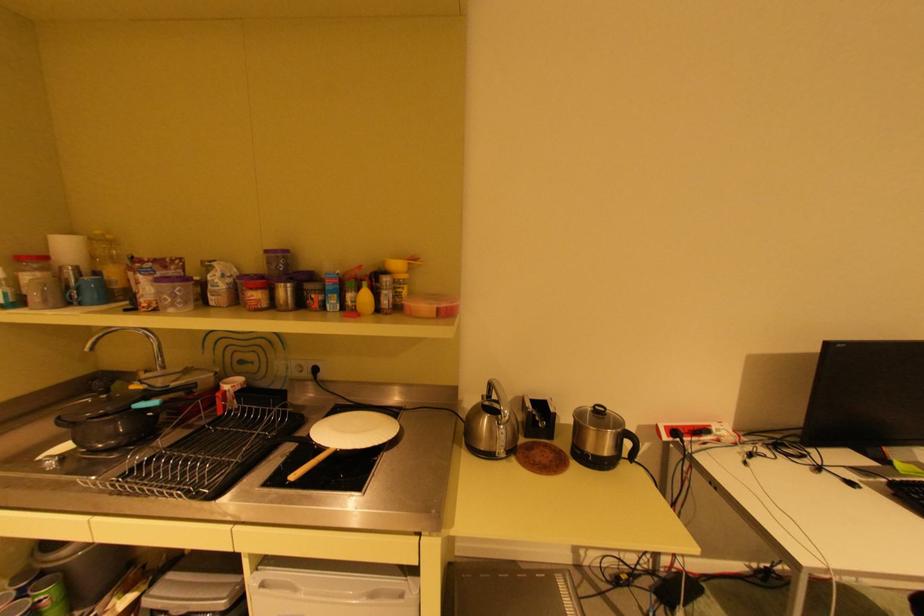
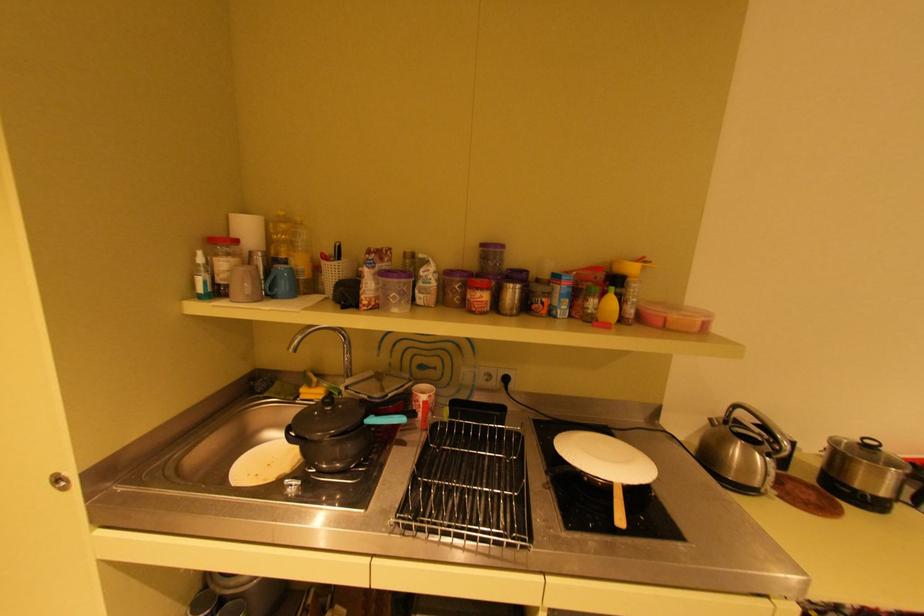
Find the pixel in the second image that matches [234,392] in the first image.

(432, 402)